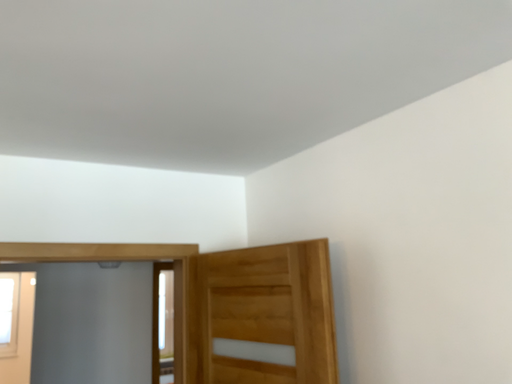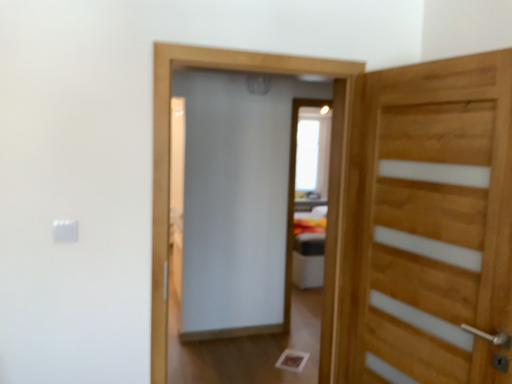
Question: Which way did the camera rotate in the video?

Choices:
 (A) rotated left
 (B) rotated right

Answer: (A)